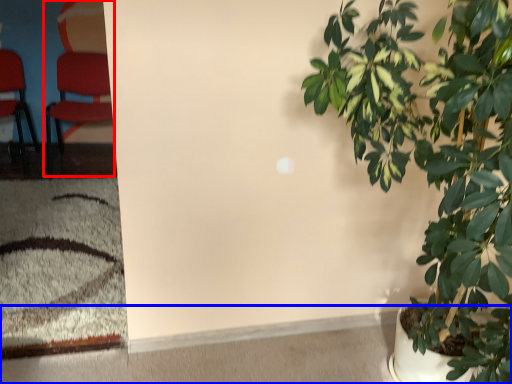
Question: Among these objects, which one is farthest to the camera, chair (highlighted by a red box) or concrete (highlighted by a blue box)?

Choices:
 (A) chair
 (B) concrete

Answer: (A)